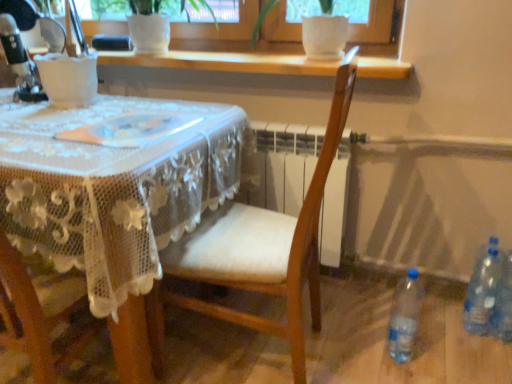
At what (x,y) coordinates should I click in order to perform the action: click on free area behind transparent plastic bottle at lower right, the 3th bottle when ordered from right to left. Please return your answer as a coordinate pair (x, y). The height and width of the screenshot is (384, 512). Looking at the image, I should click on (368, 323).